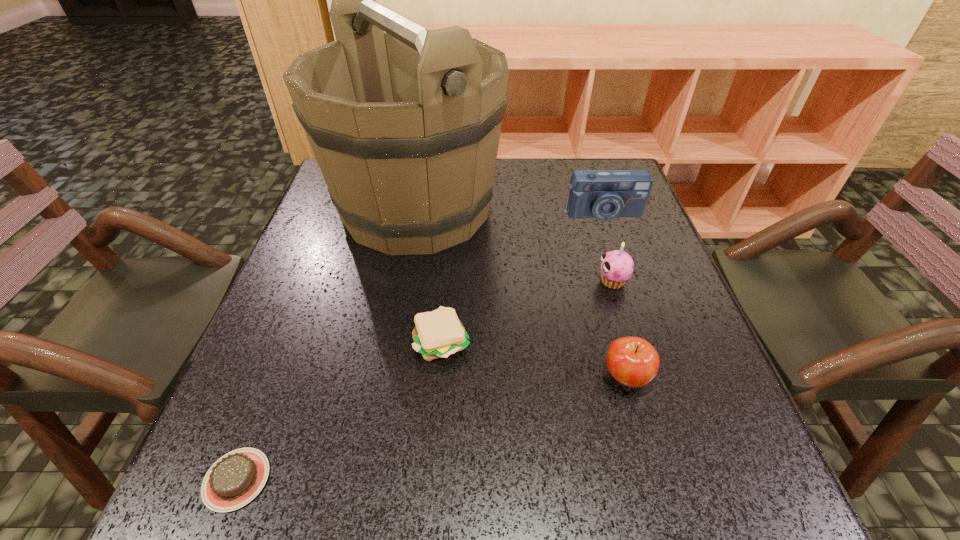
Locate an element on the screen. The image size is (960, 540). vacant position in the image that satisfies the following two spatial constraints: 1. on the face of the cupcake; 2. on the front side of the patty is located at coordinates (631, 341).